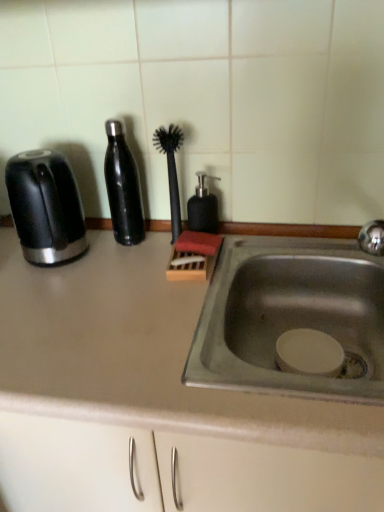
This screenshot has width=384, height=512. In order to click on free point to the right of black rubber brush at center in this screenshot , I will do `click(256, 249)`.